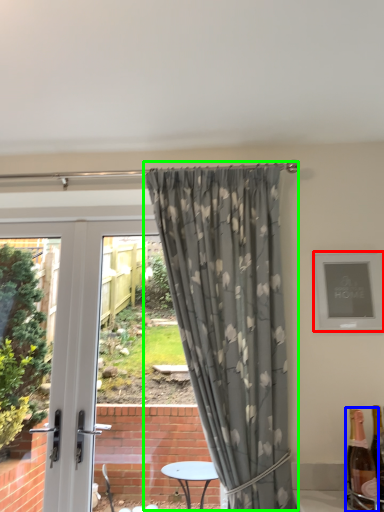
Question: Which is farther away from picture frame (highlighted by a red box)? bottle (highlighted by a blue box) or curtain (highlighted by a green box)?

Choices:
 (A) bottle
 (B) curtain

Answer: (A)